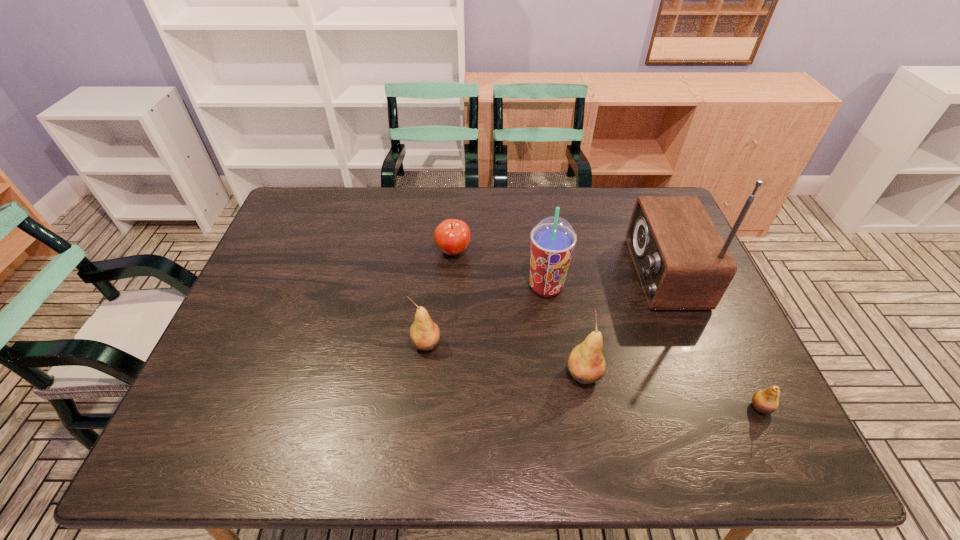
The pears are evenly distributed in the image. To maintain this, where would you place another pear on the left? Please point to a free space. Please provide its 2D coordinates. Your answer should be formatted as a tuple, i.e. [(x, y)], where the tuple contains the x and y coordinates of a point satisfying the conditions above.

[(284, 317)]